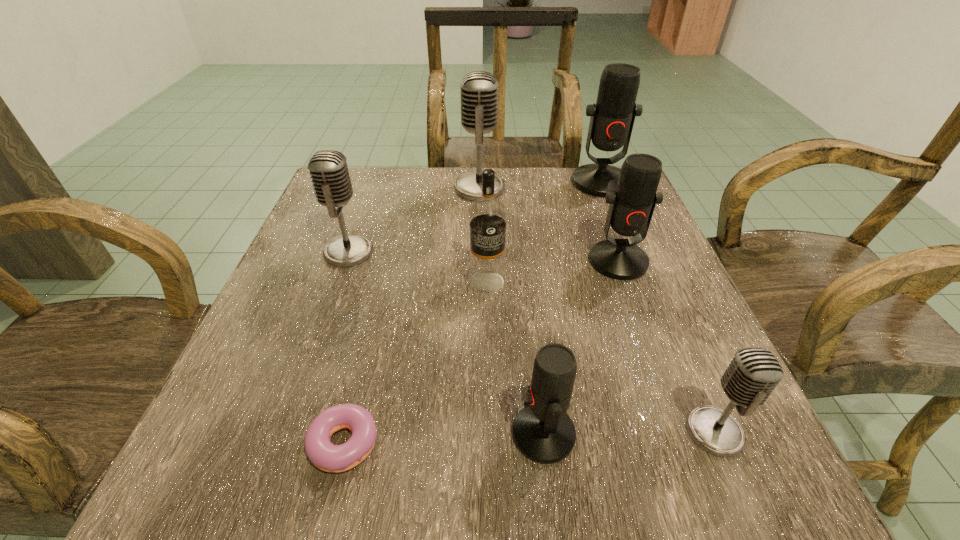
Find the location of `free region located 0.250m on the side of the leftmost red microphone with the red ring`. free region located 0.250m on the side of the leftmost red microphone with the red ring is located at coordinates (328, 434).

At what (x,y) coordinates should I click in order to perform the action: click on free space located 0.290m on the back of the smallest gray microphone. Please return your answer as a coordinate pair (x, y). The height and width of the screenshot is (540, 960). Looking at the image, I should click on 647,273.

Where is `free space located 0.280m on the back of the shortest object`? free space located 0.280m on the back of the shortest object is located at coordinates (379, 280).

Find the location of a particular element. This screenshot has width=960, height=540. doughnut that is at the near edge is located at coordinates (323, 454).

Where is `microphone that is at the left edge`? The height and width of the screenshot is (540, 960). microphone that is at the left edge is located at coordinates (328, 169).

This screenshot has height=540, width=960. I want to click on doughnut present at the left edge, so click(x=323, y=454).

Identify the location of object that is at the near left corner. This screenshot has width=960, height=540. (323, 454).

Where is `object that is at the far right corner`? object that is at the far right corner is located at coordinates (612, 118).

I want to click on object at the near right corner, so click(753, 373).

Image resolution: width=960 pixels, height=540 pixels. In order to click on vacant point at the far edge in this screenshot , I will do `click(513, 190)`.